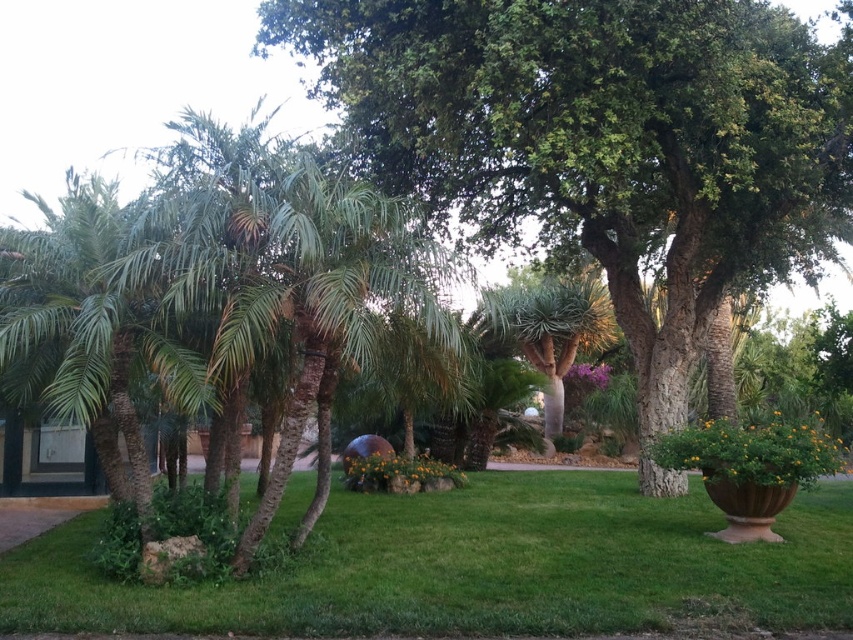
Is green leafy palm tree at left to the left of green leafy palm tree at center from the viewer's perspective?

Yes, green leafy palm tree at left is to the left of green leafy palm tree at center.

Which is behind, point (144, 528) or point (590, 337)?

Point (590, 337)

You are a GUI agent. You are given a task and a screenshot of the screen. Output one action in this format:
    pyautogui.click(x=<x>, y=<y>)
    Task: Click on the green leafy palm tree at left
    Image resolution: width=853 pixels, height=640 pixels.
    Given the screenshot: What is the action you would take?
    pyautogui.click(x=88, y=332)

Describe the element at coordinates (604, 141) in the screenshot. I see `green leafy tree at center` at that location.

Which is in front, point (595, 250) or point (7, 349)?

Point (7, 349) is in front.

Is point (500, 19) behind point (15, 356)?

Yes, point (500, 19) is farther from viewer.

Identify the location of green leafy tree at center. The height and width of the screenshot is (640, 853). (604, 141).

Between green grass at center and green leafy palm tree at center, which one has less height?

Standing shorter between the two is green grass at center.

Can you confirm if green grass at center is shorter than green leafy palm tree at center?

Indeed, green grass at center has a lesser height compared to green leafy palm tree at center.

Does point (805, 500) come farther from viewer compared to point (604, 294)?

No.

Locate an element on the screen. green grass at center is located at coordinates (471, 566).